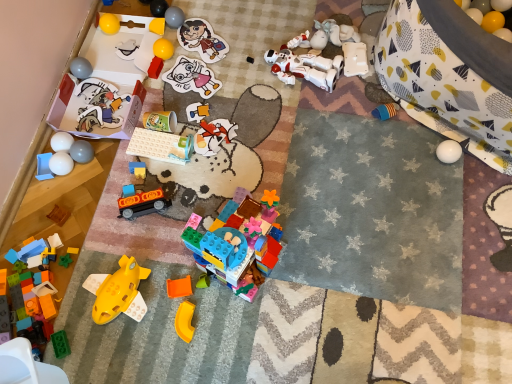
Question: Is yellow matte plastic toy at lower center, which appears as the 21th toy when viewed from the left, wider than blue plastic tray at lower left, positioned as the 26th toy in right-to-left order?

Choices:
 (A) no
 (B) yes

Answer: (A)

Question: Is yellow matte plastic toy at lower center, which appears as the 21th toy when viewed from the left, positioned far away from blue plastic tray at lower left, positioned as the 26th toy in right-to-left order?

Choices:
 (A) no
 (B) yes

Answer: (A)

Question: Considering the relative positions of yellow matte plastic toy at lower center, which ranks as the sixth toy in right-to-left order, and blue plastic tray at lower left, positioned as the 26th toy in right-to-left order, in the image provided, is yellow matte plastic toy at lower center, which ranks as the sixth toy in right-to-left order, in front of blue plastic tray at lower left, positioned as the 26th toy in right-to-left order,?

Choices:
 (A) yes
 (B) no

Answer: (A)

Question: Is blue plastic tray at lower left, the first toy in the left-to-right sequence, a part of yellow matte plastic toy at lower center, which ranks as the sixth toy in right-to-left order?

Choices:
 (A) no
 (B) yes

Answer: (A)

Question: Considering the relative sizes of yellow matte plastic toy at lower center, which appears as the 21th toy when viewed from the left, and blue plastic tray at lower left, positioned as the 26th toy in right-to-left order, in the image provided, is yellow matte plastic toy at lower center, which appears as the 21th toy when viewed from the left, shorter than blue plastic tray at lower left, positioned as the 26th toy in right-to-left order,?

Choices:
 (A) no
 (B) yes

Answer: (B)

Question: From a real-world perspective, is yellow matte plastic toy at lower center, which appears as the 21th toy when viewed from the left, on top of blue plastic tray at lower left, the first toy in the left-to-right sequence?

Choices:
 (A) no
 (B) yes

Answer: (B)

Question: Is wooden block at lower left, which appears as the fourth toy when viewed from the left, to the right of yellow rubber ball at upper right, which ranks as the 26th toy in left-to-right order, from the viewer's perspective?

Choices:
 (A) no
 (B) yes

Answer: (A)

Question: Is wooden block at lower left, placed as the 23th toy when sorted from right to left, located outside yellow rubber ball at upper right, the first toy from the right?

Choices:
 (A) no
 (B) yes

Answer: (B)

Question: From a real-world perspective, is wooden block at lower left, placed as the 23th toy when sorted from right to left, below yellow rubber ball at upper right, which ranks as the 26th toy in left-to-right order?

Choices:
 (A) no
 (B) yes

Answer: (B)

Question: From a real-world perspective, is wooden block at lower left, placed as the 23th toy when sorted from right to left, located higher than yellow rubber ball at upper right, which ranks as the 26th toy in left-to-right order?

Choices:
 (A) no
 (B) yes

Answer: (A)

Question: Is wooden block at lower left, placed as the 23th toy when sorted from right to left, wider than yellow rubber ball at upper right, the first toy from the right?

Choices:
 (A) no
 (B) yes

Answer: (A)

Question: Does wooden block at lower left, placed as the 23th toy when sorted from right to left, have a greater height compared to yellow rubber ball at upper right, the first toy from the right?

Choices:
 (A) no
 (B) yes

Answer: (A)

Question: Is yellow matte plastic toy at lower center, which ranks as the sixth toy in right-to-left order, bigger than black plastic toy at center, the 4th toy in the right-to-left sequence?

Choices:
 (A) yes
 (B) no

Answer: (A)